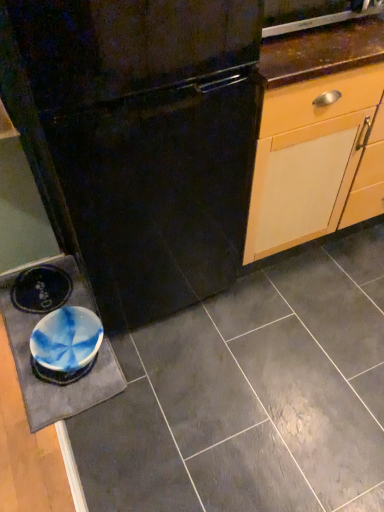
Where is `empty space that is in between black matte refrigerator at center and blue marbled slate at lower left`? This screenshot has width=384, height=512. empty space that is in between black matte refrigerator at center and blue marbled slate at lower left is located at coordinates (167, 348).